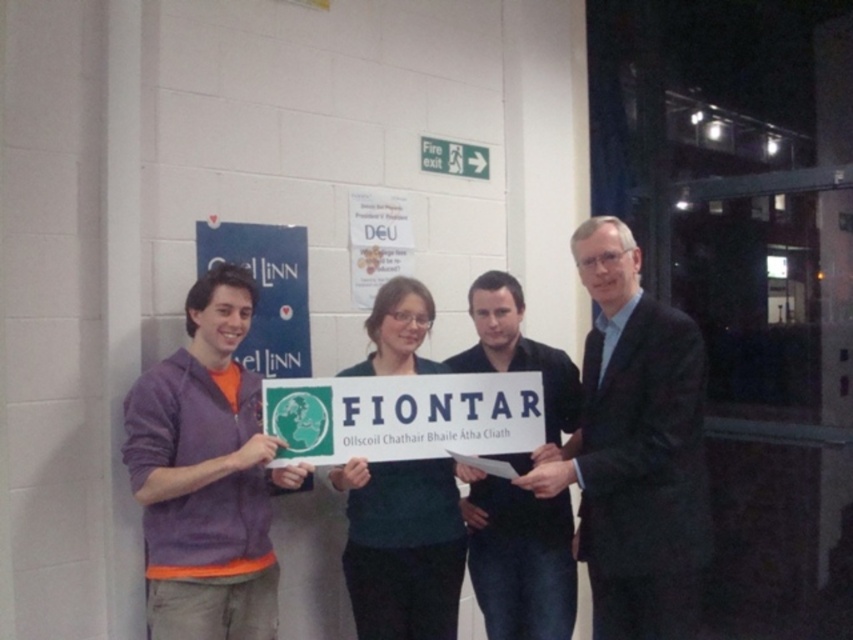
Between point (685, 627) and point (492, 280), which one is positioned in front?

Point (685, 627) is in front.

Locate an element on the screen. The image size is (853, 640). dark suit at center is located at coordinates (635, 449).

Can you confirm if dark suit at center is positioned below purple sweater at left?

Incorrect, dark suit at center is not positioned below purple sweater at left.

Which is more to the right, dark suit at center or purple sweater at left?

dark suit at center is more to the right.

Is point (688, 440) closer to camera compared to point (144, 456)?

No, it is not.

Where is `dark suit at center`? dark suit at center is located at coordinates (635, 449).

Who is shorter, purple sweater at left or dark blue shirt at center?

purple sweater at left is shorter.

The image size is (853, 640). What do you see at coordinates (207, 474) in the screenshot? I see `purple sweater at left` at bounding box center [207, 474].

At what (x,y) coordinates should I click in order to perform the action: click on purple sweater at left. Please return your answer as a coordinate pair (x, y). Image resolution: width=853 pixels, height=640 pixels. Looking at the image, I should click on (207, 474).